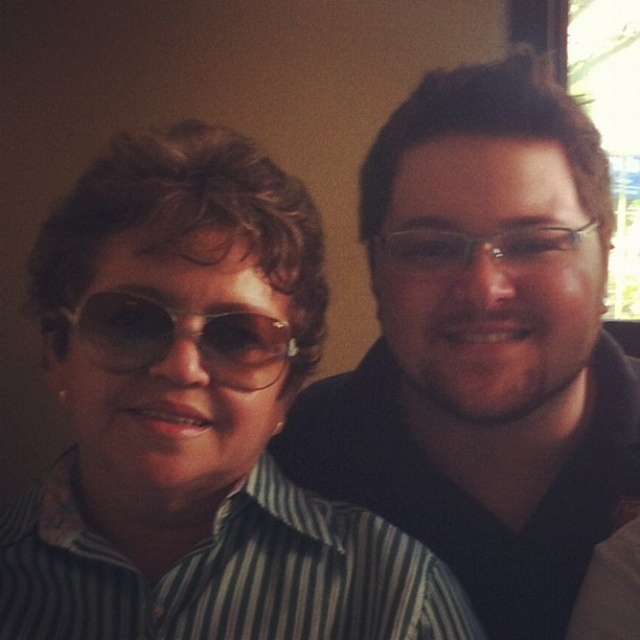
You are an AI analyzing an image of two people. You need to determine the exact position of the matte black sunglasses at upper left. What are their coordinates?

The coordinates of the matte black sunglasses at upper left are at point [195,419].

You are a photographer adjusting the camera focus. You need to ensure both the matte black shirt at right and the sunglasses at left are in focus. Given their sizes, which object should you adjust the focus on first to accommodate the larger size?

The matte black shirt at right is larger in size than the sunglasses at left, so you should adjust the focus on the matte black shirt at right first to ensure it is properly in focus before adjusting for the smaller sunglasses at left.